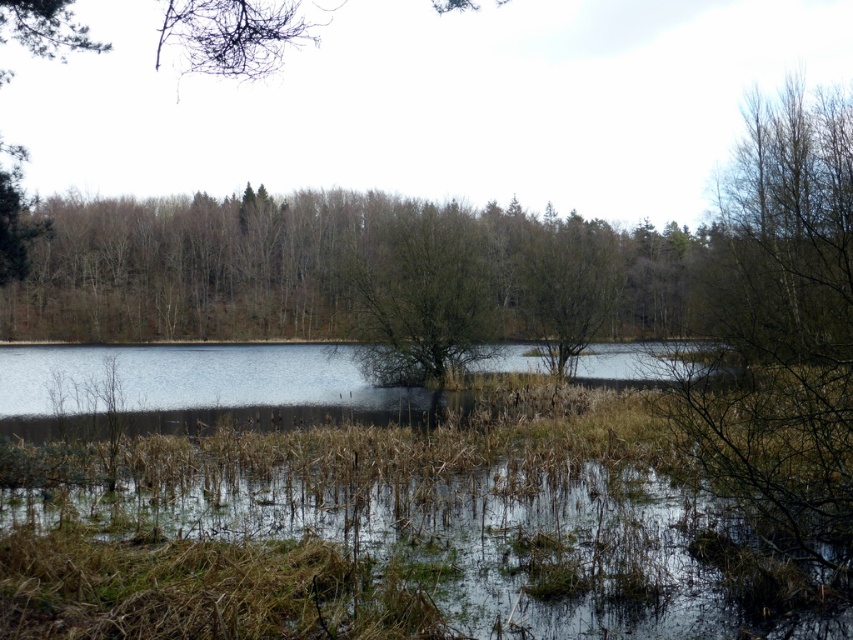
Does green matte tree at center appear under brown matte tree at center?

No.

Is point (457, 218) positioned before point (579, 259)?

No, it is behind (579, 259).

Is point (451, 243) behind point (611, 259)?

No.

Image resolution: width=853 pixels, height=640 pixels. What are the coordinates of `green matte tree at center` in the screenshot? It's located at (x=422, y=294).